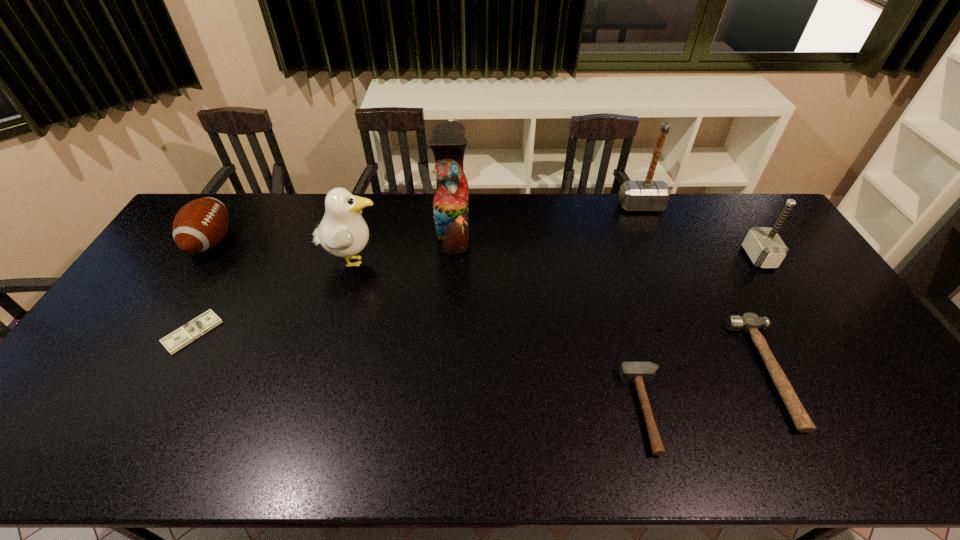
Identify the location of parrot. This screenshot has width=960, height=540. (x=450, y=205).

This screenshot has height=540, width=960. Identify the location of the third hammer from right to left. (648, 195).

Where is `the farthest hammer`? the farthest hammer is located at coordinates (648, 195).

Locate an element on the screen. the sixth object from right to left is located at coordinates (343, 232).

Find the location of `gull`. gull is located at coordinates (343, 232).

What are the coordinates of `the third nearest hammer` in the screenshot? It's located at (763, 245).

I want to click on the rightmost object, so click(x=763, y=245).

You are a GUI agent. You are given a task and a screenshot of the screen. Output one action in this format:
    pyautogui.click(x=<x>, y=<y>)
    Task: Click on the football
    The width and height of the screenshot is (960, 540).
    Given the screenshot: What is the action you would take?
    pyautogui.click(x=199, y=225)

The height and width of the screenshot is (540, 960). Identify the location of the third hammer from left to right. point(750,323).

Where is `the leftmost hammer`? the leftmost hammer is located at coordinates (639, 372).